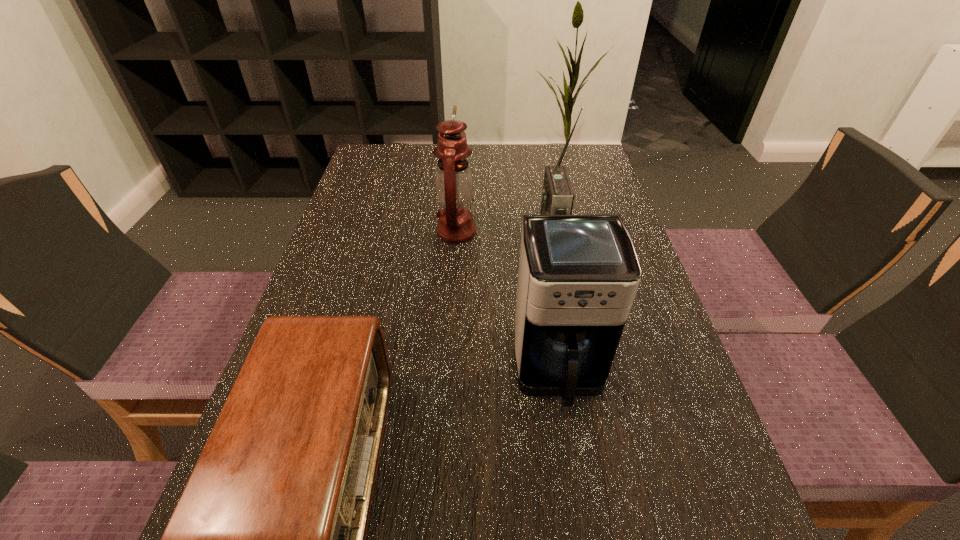
At what (x,y) coordinates should I click in order to perform the action: click on the farther radio receiver. Please return your answer as a coordinate pair (x, y). The width and height of the screenshot is (960, 540). Looking at the image, I should click on (557, 197).

The image size is (960, 540). What are the coordinates of `the taller radio receiver` in the screenshot? It's located at (557, 197).

You are a GUI agent. You are given a task and a screenshot of the screen. Output one action in this format:
    pyautogui.click(x=<x>, y=<y>)
    Task: Click on the second object from left to right
    The image size is (960, 540).
    Given the screenshot: What is the action you would take?
    pyautogui.click(x=454, y=184)

Where is `coffee maker`? The height and width of the screenshot is (540, 960). coffee maker is located at coordinates (578, 275).

The height and width of the screenshot is (540, 960). I want to click on free point located on the display of the farther radio receiver, so click(x=451, y=237).

The image size is (960, 540). I want to click on vacant space positioned on the display of the farther radio receiver, so click(x=460, y=237).

Locate an element on the screen. This screenshot has height=540, width=960. vacant space situated 0.090m on the display of the farther radio receiver is located at coordinates (505, 237).

Where is `free region located 0.190m on the left of the third object from right to left`? The height and width of the screenshot is (540, 960). free region located 0.190m on the left of the third object from right to left is located at coordinates (360, 232).

Find the location of a particular element. Image resolution: width=960 pixels, height=540 pixels. radio receiver situated at the right edge is located at coordinates (557, 197).

This screenshot has height=540, width=960. Find the location of `coffee maker located at the right edge`. coffee maker located at the right edge is located at coordinates (578, 275).